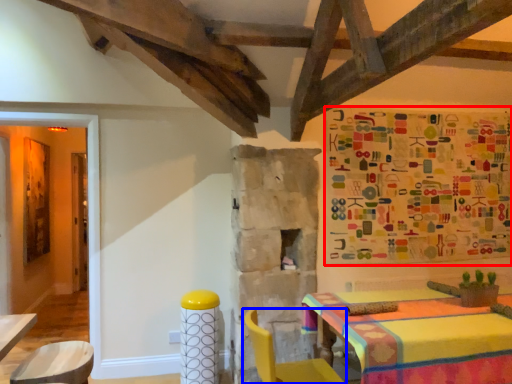
Question: Which of the following is the closest to the observer, tapestry (highlighted by a red box) or chair (highlighted by a blue box)?

Choices:
 (A) tapestry
 (B) chair

Answer: (B)